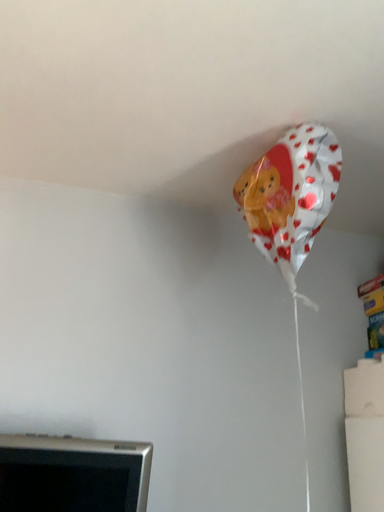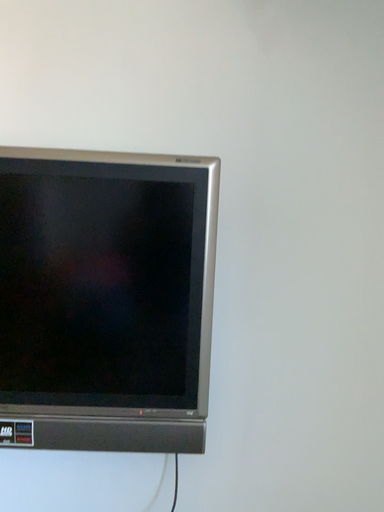
Question: How did the camera likely rotate when shooting the video?

Choices:
 (A) rotated left
 (B) rotated right

Answer: (A)